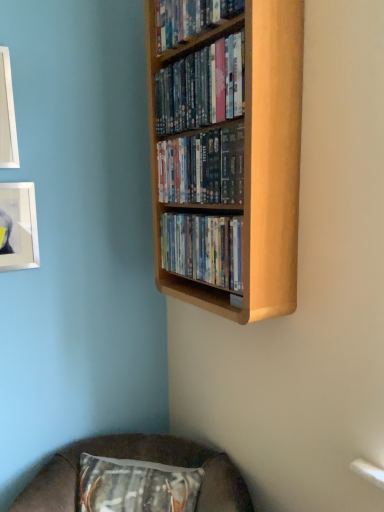
Question: From a real-world perspective, is white glossy picture frame at upper left, which is the first picture frame from top to bottom, positioned over wooden shelf at upper center, which appears as the 2th book when viewed from the top, based on gravity?

Choices:
 (A) yes
 (B) no

Answer: (B)

Question: Does white glossy picture frame at upper left, which is the first picture frame from top to bottom, have a greater height compared to wooden shelf at upper center, which appears as the 2th book when viewed from the top?

Choices:
 (A) no
 (B) yes

Answer: (B)

Question: Is white glossy picture frame at upper left, which is the first picture frame from top to bottom, closer to the viewer compared to wooden shelf at upper center, the 3th book from the bottom?

Choices:
 (A) no
 (B) yes

Answer: (A)

Question: Can you confirm if white glossy picture frame at upper left, which is the first picture frame from top to bottom, is wider than wooden shelf at upper center, the 3th book from the bottom?

Choices:
 (A) yes
 (B) no

Answer: (B)

Question: Based on their positions, is wooden shelf at upper center, the 3th book from the bottom, located to the left or right of matte plastic dvds at center, which ranks as the first book in bottom-to-top order?

Choices:
 (A) right
 (B) left

Answer: (B)

Question: Based on their sizes in the image, would you say wooden shelf at upper center, the 3th book from the bottom, is bigger or smaller than matte plastic dvds at center, which ranks as the first book in bottom-to-top order?

Choices:
 (A) small
 (B) big

Answer: (A)

Question: From a real-world perspective, is wooden shelf at upper center, which appears as the 2th book when viewed from the top, physically located above or below matte plastic dvds at center, which ranks as the first book in bottom-to-top order?

Choices:
 (A) above
 (B) below

Answer: (A)

Question: From the image's perspective, is wooden shelf at upper center, which appears as the 2th book when viewed from the top, above or below matte plastic dvds at center, arranged as the 4th book when viewed from the top?

Choices:
 (A) above
 (B) below

Answer: (A)

Question: Considering the positions of metallic silver picture frame at upper left, marked as the second picture frame in a top-to-bottom arrangement, and matte plastic dvds at center, which ranks as the first book in bottom-to-top order, in the image, is metallic silver picture frame at upper left, marked as the second picture frame in a top-to-bottom arrangement, taller or shorter than matte plastic dvds at center, which ranks as the first book in bottom-to-top order,?

Choices:
 (A) short
 (B) tall

Answer: (B)

Question: Is point (18, 257) closer or farther from the camera than point (177, 224)?

Choices:
 (A) farther
 (B) closer

Answer: (A)

Question: Looking at the image, does metallic silver picture frame at upper left, the first picture frame in the bottom-to-top sequence, seem bigger or smaller compared to matte plastic dvds at center, which ranks as the first book in bottom-to-top order?

Choices:
 (A) big
 (B) small

Answer: (B)

Question: Is metallic silver picture frame at upper left, marked as the second picture frame in a top-to-bottom arrangement, inside the boundaries of matte plastic dvds at center, arranged as the 4th book when viewed from the top, or outside?

Choices:
 (A) outside
 (B) inside

Answer: (A)

Question: From their relative heights in the image, would you say brown fabric cushion at lower center is taller or shorter than shiny plastic dvds at center, arranged as the 3th book when viewed from the top?

Choices:
 (A) short
 (B) tall

Answer: (B)

Question: Does point (142, 437) appear closer or farther from the camera than point (215, 162)?

Choices:
 (A) farther
 (B) closer

Answer: (A)